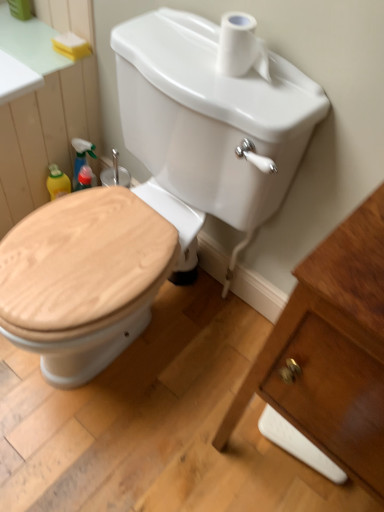
Identify the location of vacant region to the left of white glossy porcelain at right. (188, 432).